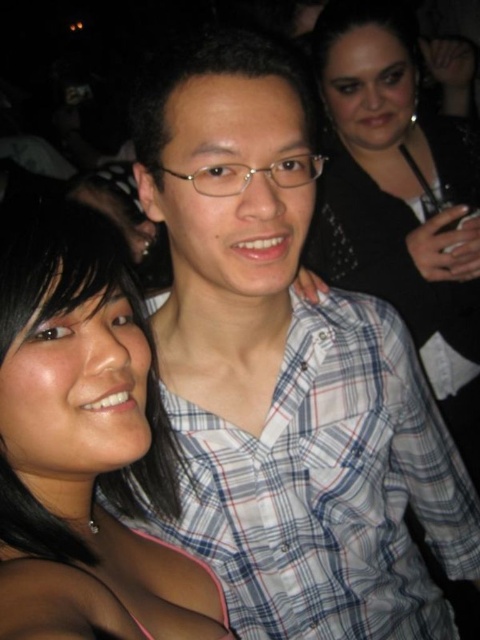
You are at a party and want to take a photo with both the white checkered shirt at center and the black matte hair at center. Since you want them both in the frame, which one should you position closer to the camera?

The white checkered shirt at center is taller than black matte hair at center, so you should position the black matte hair at center closer to the camera to ensure both are in the frame.

You are a photographer trying to capture a group photo of the two people in the scene. The minimum distance required for your camera to focus properly is 75 centimeters. Based on the scene, will you be able to take a clear photo of both the white checkered shirt at center and the other person?

The two individuals are 76.24 centimeters apart, which is just over the minimum focusing distance of 75 centimeters. Therefore, the photographer can take a clear photo of both the white checkered shirt at center and the other person.

You are a photographer at a party and want to take a group photo of the white checkered shirt at center and the black sequined dress at upper right. Which person should stand closer to the camera to ensure both are in focus?

The white checkered shirt at center should stand closer to the camera because it is shorter than the black sequined dress at upper right, so adjusting their position will help both be in focus.